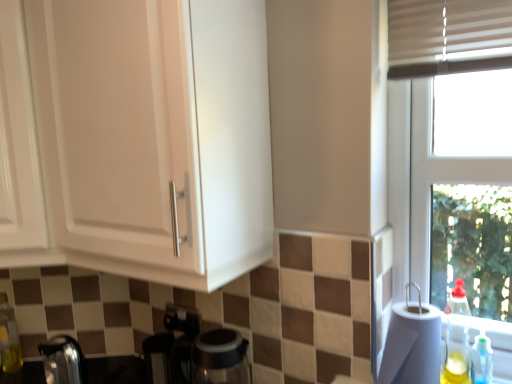
Question: From their relative heights in the image, would you say translucent glass bottle at lower left, the 1th bottle in the left-to-right sequence, is taller or shorter than white matte cabinet at upper left, the first cabinetry in the right-to-left sequence?

Choices:
 (A) tall
 (B) short

Answer: (B)

Question: From a real-world perspective, is translucent glass bottle at lower left, the 1th bottle in the left-to-right sequence, positioned above or below white matte cabinet at upper left, marked as the 2th cabinetry in a left-to-right arrangement?

Choices:
 (A) above
 (B) below

Answer: (B)

Question: Based on their relative distances, which object is nearer to the white glossy cabinet at upper left, positioned as the first cabinetry in left-to-right order?

Choices:
 (A) translucent plastic bottle at right, the second bottle viewed from the back
 (B) transparent glass coffee machine at lower center
 (C) satin chrome faucet at lower left
 (D) white paper towel at right
 (E) metallic stainless steel kettle at lower left

Answer: (C)

Question: Estimate the real-world distances between objects in this image. Which object is farther from the translucent plastic bottle at right, which is the second bottle from front to back?

Choices:
 (A) white matte cabinet at upper left, the first cabinetry in the right-to-left sequence
 (B) metallic stainless steel kettle at lower left
 (C) translucent glass bottle at lower left, the 1th bottle in the left-to-right sequence
 (D) white glossy cabinet at upper left, positioned as the first cabinetry in left-to-right order
 (E) transparent glass coffee machine at lower center

Answer: (D)